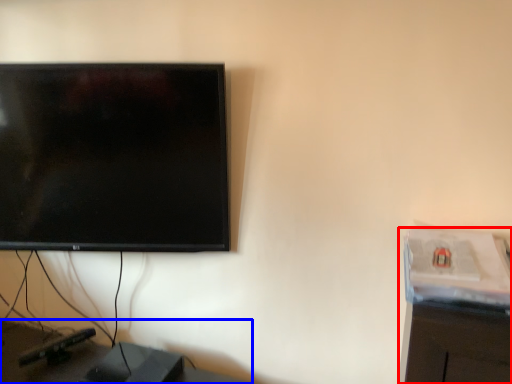
Question: Which object is closer to the camera taking this photo, computer desk (highlighted by a red box) or furniture (highlighted by a blue box)?

Choices:
 (A) computer desk
 (B) furniture

Answer: (A)